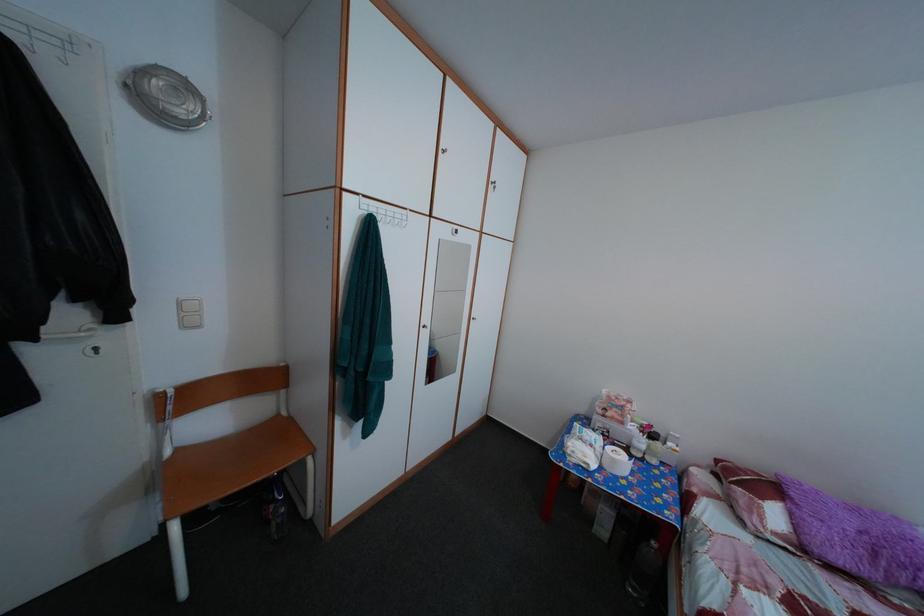
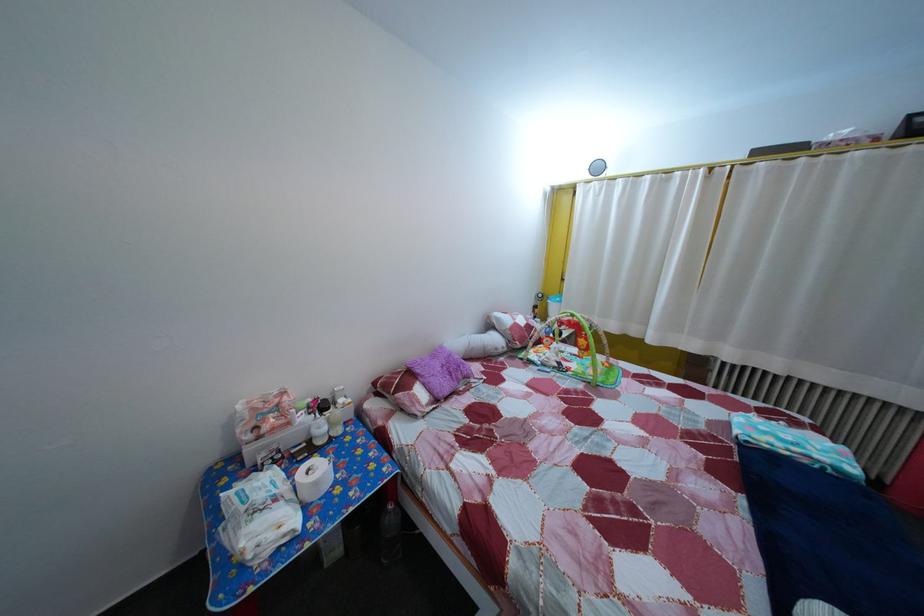
In the second image, find the point that corresponds to the point at 663,551 in the first image.

(399, 515)